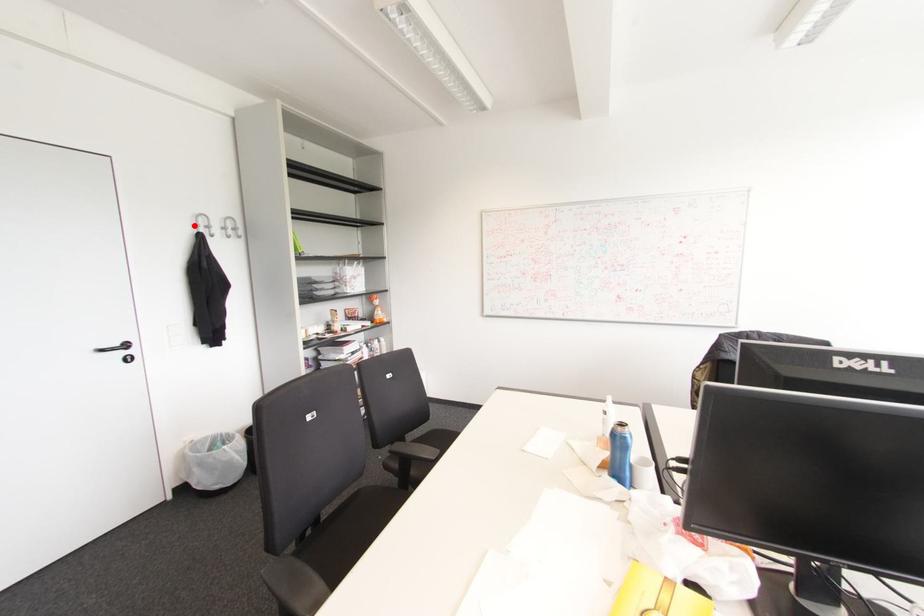
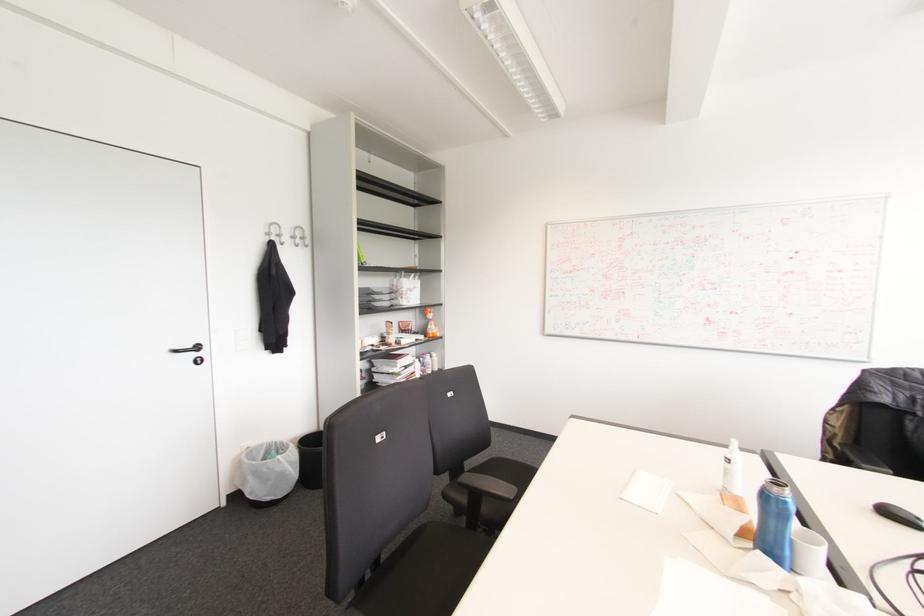
The point at the highlighted location is marked in the first image. Where is the corresponding point in the second image?

(266, 233)